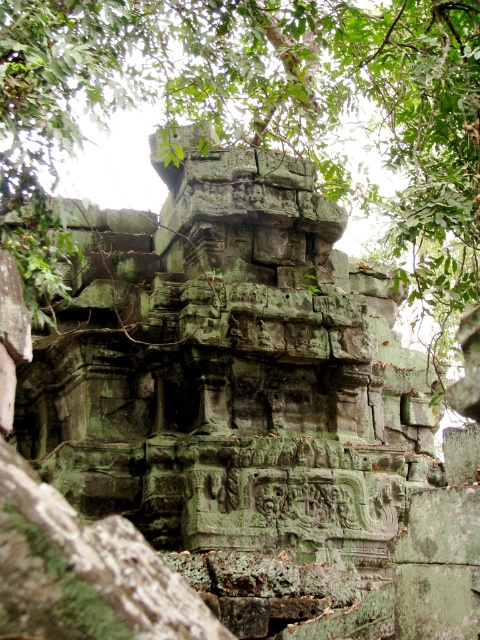
Does green mossy stone at upper center have a lesser height compared to green mossy bark at center?

No.

Is green mossy stone at upper center positioned before green mossy bark at center?

No, it is behind green mossy bark at center.

Does point (93, 90) lie behind point (19, 484)?

Yes, it is.

The image size is (480, 640). Identify the location of green mossy stone at upper center. (273, 96).